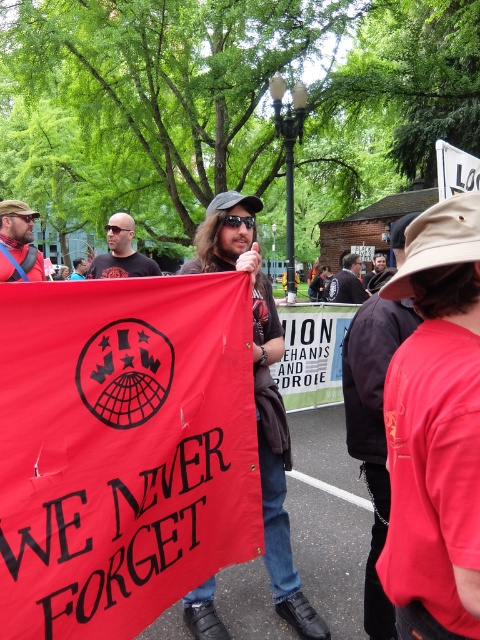
Is red matte banner at center thinner than matte black shirt at center?

Incorrect, red matte banner at center's width is not less than matte black shirt at center's.

Is red matte banner at center wider than matte black shirt at center?

Yes, red matte banner at center is wider than matte black shirt at center.

In order to click on red matte banner at center in this screenshot , I will do `click(122, 449)`.

Does red matte banner at center have a greater height compared to matte black sunglasses at center?

Incorrect, red matte banner at center's height is not larger of matte black sunglasses at center's.

Which is in front, point (43, 556) or point (131, 218)?

Point (43, 556) is more forward.

Locate an element on the screen. This screenshot has height=640, width=480. red matte banner at center is located at coordinates (122, 449).

Describe the element at coordinates (122, 449) in the screenshot. This screenshot has width=480, height=640. I see `red matte banner at center` at that location.

Does red matte banner at center have a lesser width compared to red fabric banner at center?

Indeed, red matte banner at center has a lesser width compared to red fabric banner at center.

Who is more distant from viewer, (143,284) or (340,349)?

The point (340,349) is more distant.

I want to click on red matte banner at center, so click(x=122, y=449).